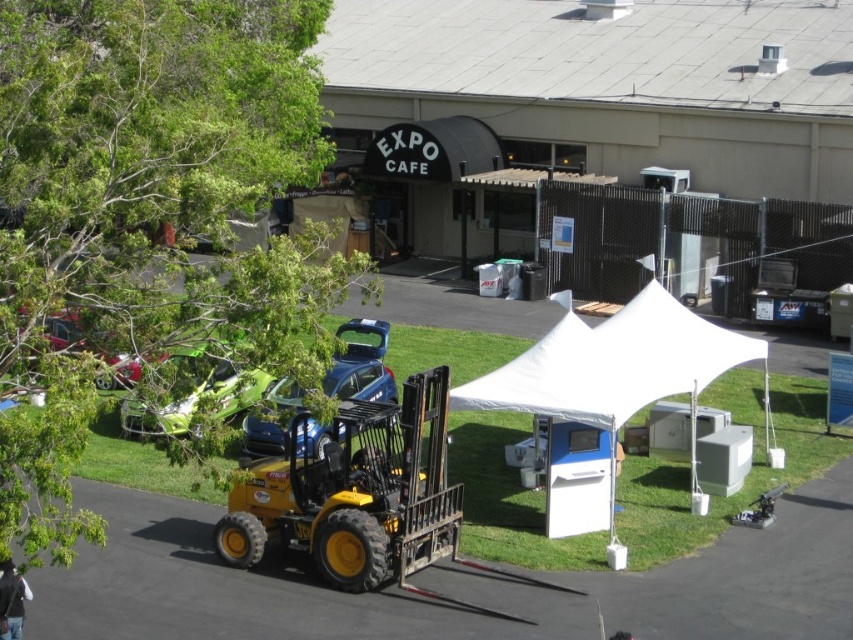
Who is more distant from viewer, (x=381, y=454) or (x=160, y=417)?

The point (x=381, y=454) is behind.

Is yellow metallic forklift at center shorter than green matte car at lower left?

Incorrect, yellow metallic forklift at center's height does not fall short of green matte car at lower left's.

Locate an element on the screen. This screenshot has width=853, height=640. yellow metallic forklift at center is located at coordinates (354, 492).

Between yellow metallic forklift at center and blue matte car at center, which one has more height?

With more height is yellow metallic forklift at center.

Is point (230, 520) behind point (380, 392)?

No, it is in front of (380, 392).

Between point (412, 532) and point (392, 388), which one is positioned in front?

Point (412, 532)

Where is `yellow metallic forklift at center`? The width and height of the screenshot is (853, 640). yellow metallic forklift at center is located at coordinates (354, 492).

Between point (389, 424) and point (607, 525), which one is positioned behind?

Positioned behind is point (607, 525).

At what (x,y) coordinates should I click in order to perform the action: click on yellow metallic forklift at center. Please return your answer as a coordinate pair (x, y). The height and width of the screenshot is (640, 853). Looking at the image, I should click on 354,492.